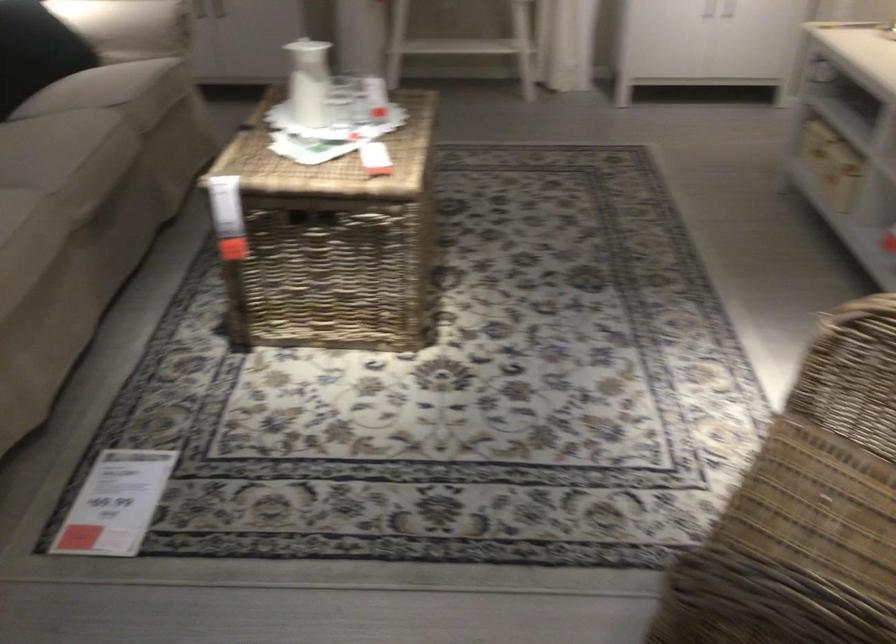
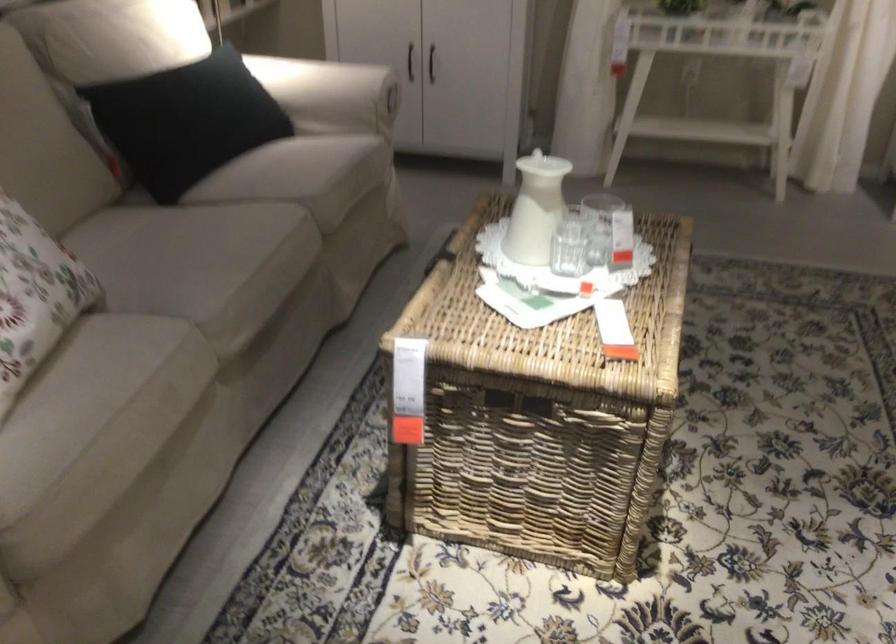
Question: What movement of the cameraman would produce the second image?

Choices:
 (A) Left
 (B) Right
 (C) Forward
 (D) Backward

Answer: (C)